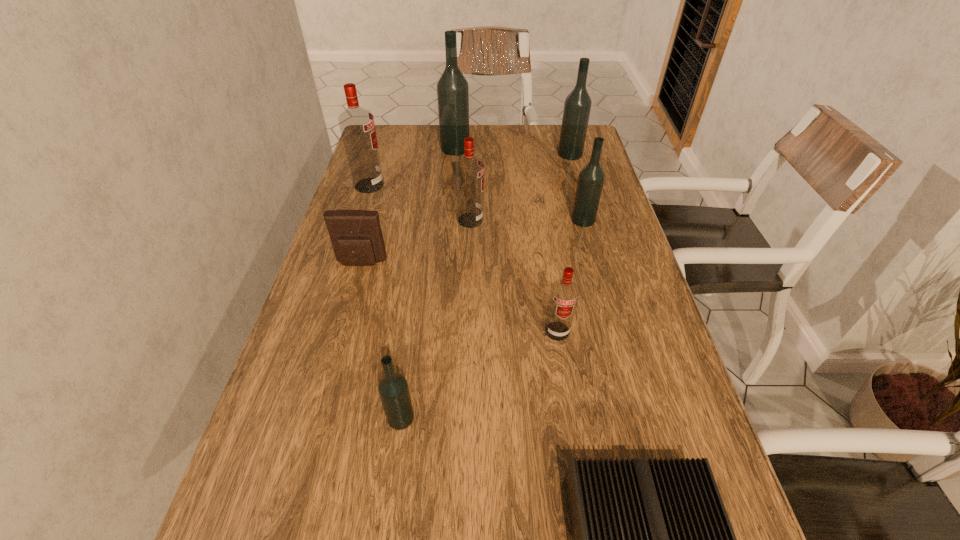
Locate an element on the screen. The image size is (960, 540). vacant space that is in between the eighth tallest object and the nearest vodka is located at coordinates (381, 340).

This screenshot has height=540, width=960. In order to click on free space between the biggest red vodka and the second red vodka from left to right in this screenshot , I will do `click(420, 202)`.

This screenshot has width=960, height=540. I want to click on free space that is in between the pouch and the smallest black vodka, so click(381, 340).

Where is `free space that is in between the tallest object and the second biggest black vodka`? This screenshot has height=540, width=960. free space that is in between the tallest object and the second biggest black vodka is located at coordinates (513, 151).

Where is `free space between the fourth nearest object and the nearest black vodka`? Image resolution: width=960 pixels, height=540 pixels. free space between the fourth nearest object and the nearest black vodka is located at coordinates (381, 340).

Locate an element on the screen. object that stands as the seventh closest to the third nearest object is located at coordinates (577, 106).

Locate which object ranks eighth in proximity to the seventh nearest object. Please provide its 2D coordinates. Your answer should be formatted as a tuple, i.e. [(x, y)], where the tuple contains the x and y coordinates of a point satisfying the conditions above.

[(651, 539)]

At what (x,y) coordinates should I click in order to perform the action: click on vodka identified as the closest to the nearest black vodka. Please return your answer as a coordinate pair (x, y). The image size is (960, 540). Looking at the image, I should click on (564, 293).

The height and width of the screenshot is (540, 960). In order to click on vodka that is the second closest one to the second biggest black vodka in this screenshot , I will do `click(452, 88)`.

Where is `black vodka that is the fourth closest to the second nearest vodka`? This screenshot has height=540, width=960. black vodka that is the fourth closest to the second nearest vodka is located at coordinates (452, 88).